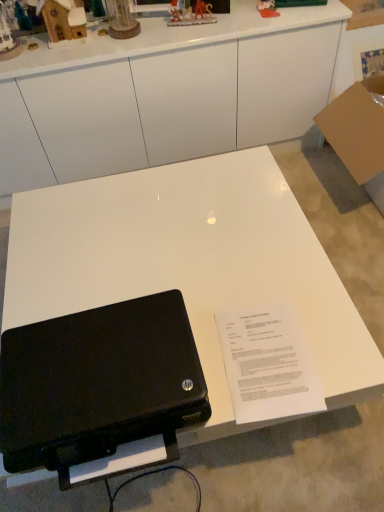
You are a GUI agent. You are given a task and a screenshot of the screen. Output one action in this format:
    pyautogui.click(x=<x>, y=<y>)
    Task: Click on the free space above white paper at center (from a real-world perspective)
    The width and height of the screenshot is (384, 512).
    Given the screenshot: What is the action you would take?
    pyautogui.click(x=268, y=359)